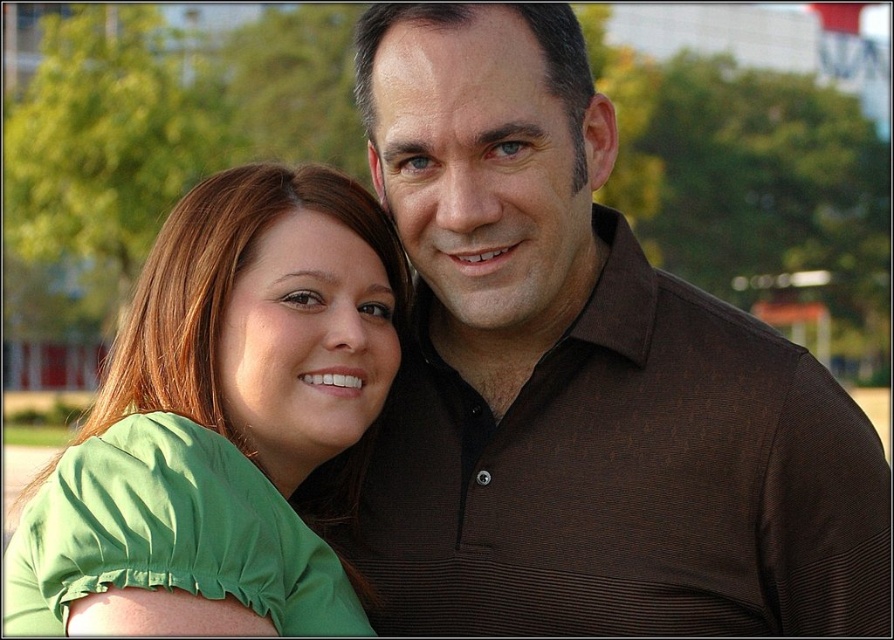
Question: Does brown textured shirt at center have a smaller size compared to green fabric shirt at left?

Choices:
 (A) yes
 (B) no

Answer: (A)

Question: Does brown textured shirt at center lie in front of green fabric shirt at left?

Choices:
 (A) no
 (B) yes

Answer: (A)

Question: Does brown textured shirt at center appear on the right side of green fabric shirt at left?

Choices:
 (A) no
 (B) yes

Answer: (B)

Question: Which point appears farthest from the camera in this image?

Choices:
 (A) (502, 624)
 (B) (359, 346)

Answer: (A)

Question: Which point is closer to the camera taking this photo?

Choices:
 (A) (129, 404)
 (B) (623, 547)

Answer: (A)